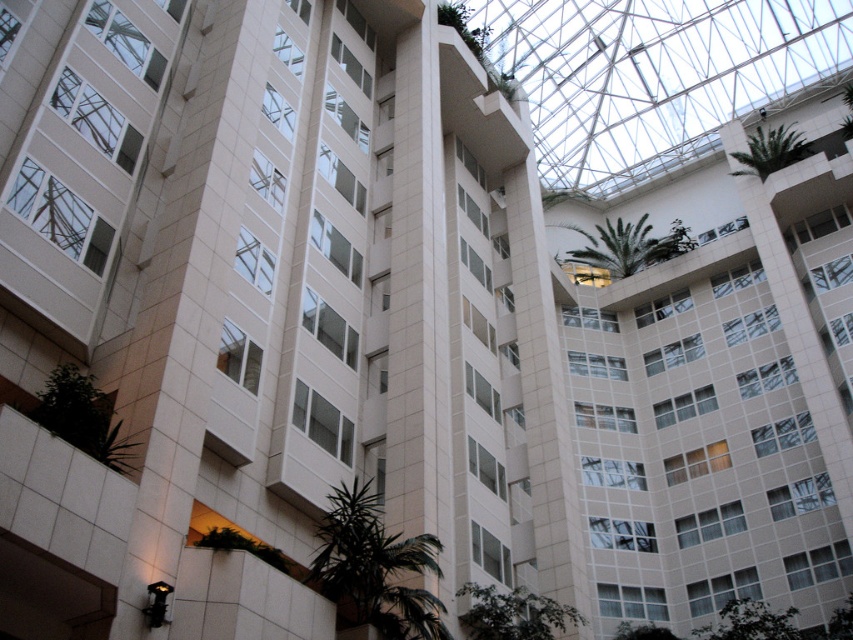
Is green leafy palm tree at lower center above green leafy palm tree at upper right?

No, green leafy palm tree at lower center is not above green leafy palm tree at upper right.

Who is positioned more to the left, green leafy palm tree at lower center or green leafy palm tree at upper right?

green leafy palm tree at lower center is more to the left.

Is point (375, 561) behind point (798, 156)?

No.

Locate an element on the screen. The image size is (853, 640). green leafy palm tree at lower center is located at coordinates (374, 568).

Between point (643, 220) and point (782, 161), which one is positioned behind?

Positioned behind is point (643, 220).

Does point (578, 252) come behind point (776, 136)?

Yes, point (578, 252) is farther from viewer.

Locate an element on the screen. Image resolution: width=853 pixels, height=640 pixels. green leafy palm tree at upper center is located at coordinates (630, 244).

Between green leafy palm tree at lower center and green leafy palm tree at upper center, which one appears on the right side from the viewer's perspective?

From the viewer's perspective, green leafy palm tree at upper center appears more on the right side.

Can you confirm if green leafy palm tree at lower center is taller than green leafy palm tree at upper center?

Incorrect, green leafy palm tree at lower center's height is not larger of green leafy palm tree at upper center's.

Where is `green leafy palm tree at lower center`? The image size is (853, 640). green leafy palm tree at lower center is located at coordinates (374, 568).